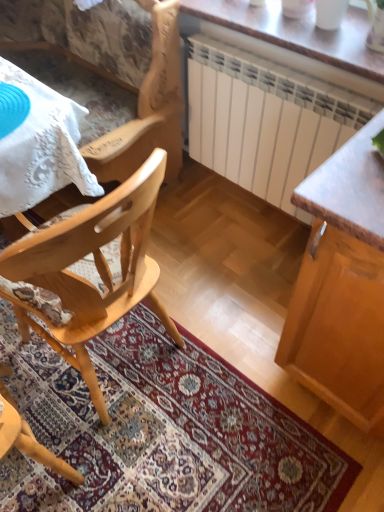
Locate an element on the screen. This screenshot has height=512, width=384. free region under carpeted mat at center (from a real-world perspective) is located at coordinates (172, 438).